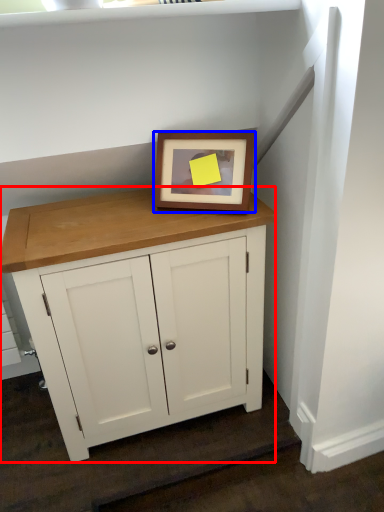
Question: Which point is further to the camera, table (highlighted by a red box) or picture frame (highlighted by a blue box)?

Choices:
 (A) table
 (B) picture frame

Answer: (B)